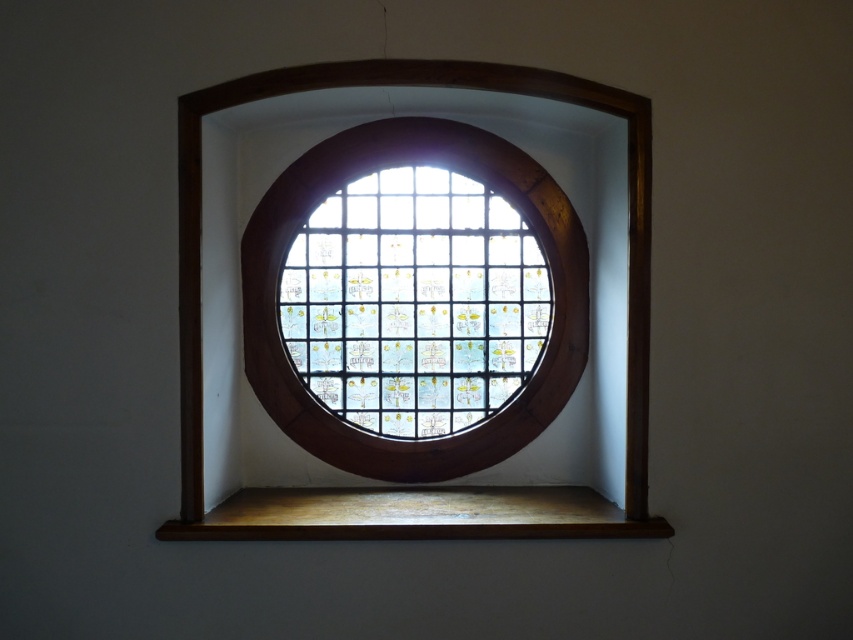
Question: Can you confirm if stained glass window at center is bigger than wooden at lower center?

Choices:
 (A) no
 (B) yes

Answer: (B)

Question: Can you confirm if stained glass window at center is thinner than wooden at lower center?

Choices:
 (A) no
 (B) yes

Answer: (B)

Question: Is stained glass window at center thinner than wooden at lower center?

Choices:
 (A) yes
 (B) no

Answer: (A)

Question: Estimate the real-world distances between objects in this image. Which object is closer to the brown wood frame at center?

Choices:
 (A) stained glass window at center
 (B) wooden at lower center

Answer: (B)

Question: Estimate the real-world distances between objects in this image. Which object is farther from the brown wood frame at center?

Choices:
 (A) stained glass window at center
 (B) wooden at lower center

Answer: (A)

Question: Which object appears farthest from the camera in this image?

Choices:
 (A) wooden at lower center
 (B) brown wood frame at center
 (C) stained glass window at center

Answer: (C)